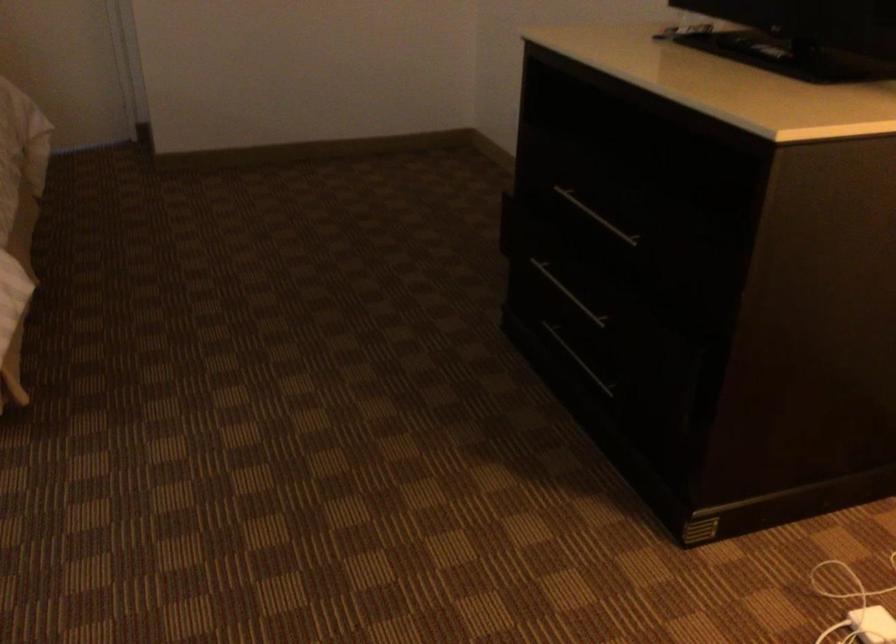
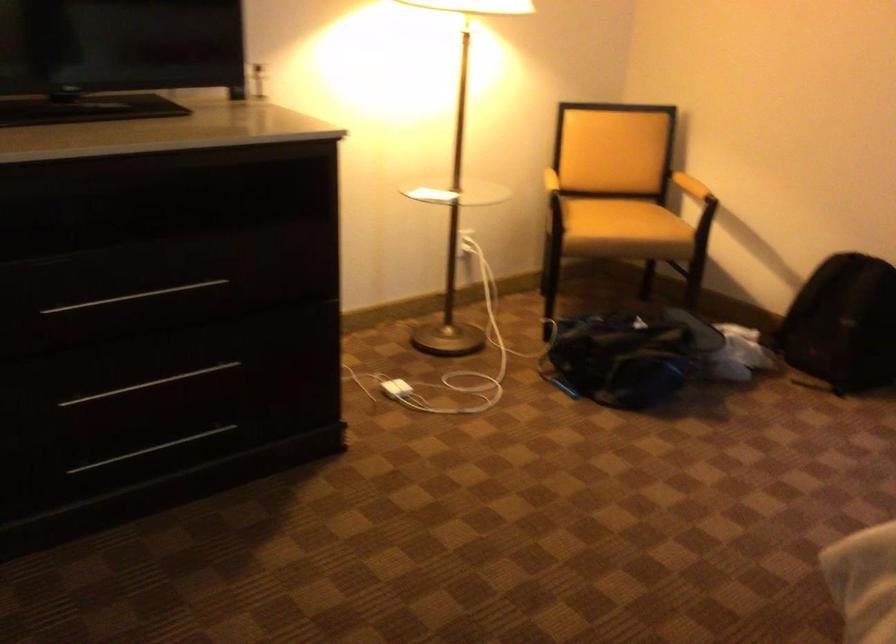
In the second image, find the point that corresponds to point (589, 363) in the first image.

(151, 449)